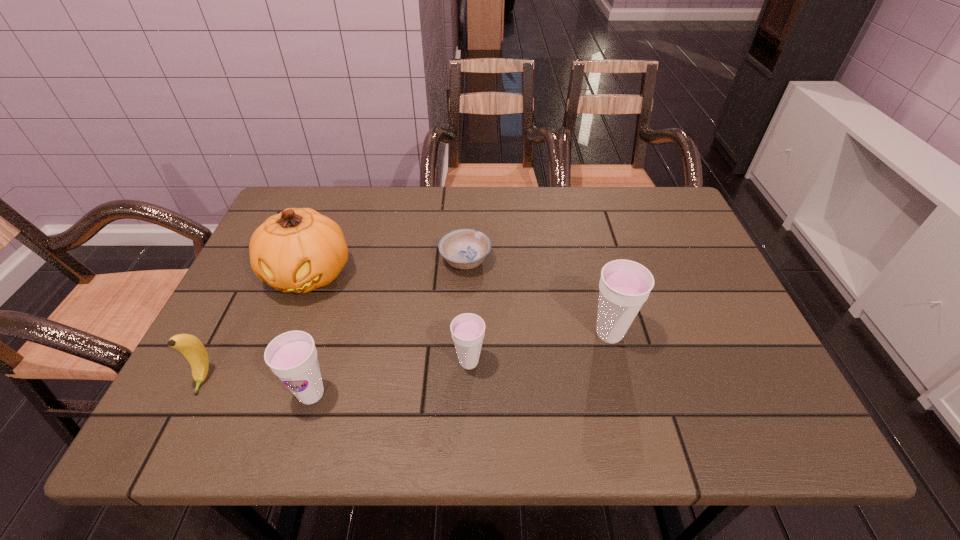
I want to click on free spot located 0.050m on the front face of the pumpkin, so click(x=290, y=324).

Find the location of `vacant space located 0.090m on the front of the shortest object`. vacant space located 0.090m on the front of the shortest object is located at coordinates (464, 306).

Where is `banana positioned at the near edge`? The height and width of the screenshot is (540, 960). banana positioned at the near edge is located at coordinates (191, 347).

Identify the location of pumpkin located in the left edge section of the desktop. This screenshot has height=540, width=960. (298, 250).

Locate an element on the screen. Image resolution: width=960 pixels, height=540 pixels. banana at the left edge is located at coordinates (191, 347).

This screenshot has height=540, width=960. What are the coordinates of `object situated at the near left corner` in the screenshot? It's located at (191, 347).

Where is `free region at the far edge of the desktop`? This screenshot has width=960, height=540. free region at the far edge of the desktop is located at coordinates (521, 208).

The width and height of the screenshot is (960, 540). I want to click on free space at the near edge, so click(x=271, y=386).

Where is `free region at the left edge of the desktop`? This screenshot has height=540, width=960. free region at the left edge of the desktop is located at coordinates (248, 272).

This screenshot has height=540, width=960. In order to click on free space at the right edge in this screenshot , I will do `click(675, 269)`.